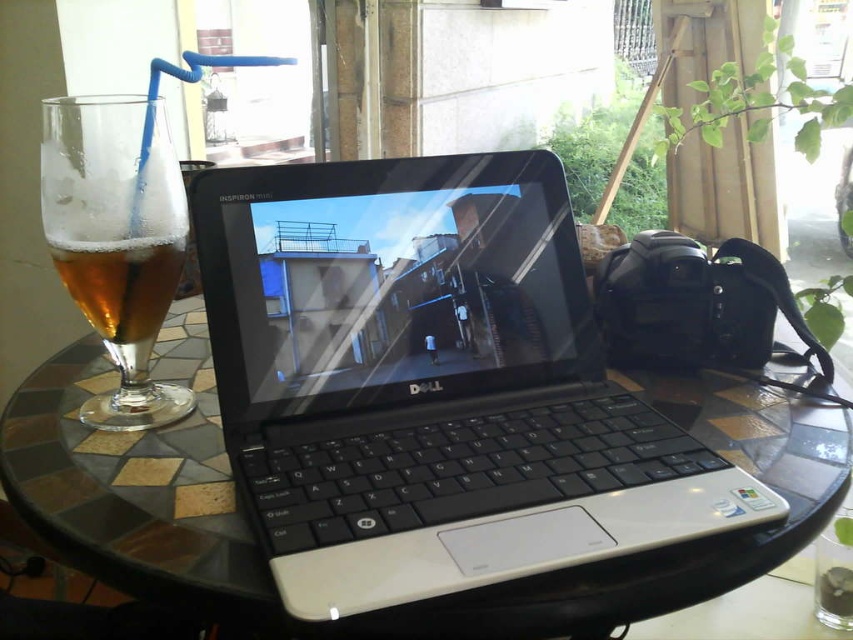
How much distance is there between black plastic laptop at center and amber glass at left?

13.35 centimeters

Is point (349, 212) positioned before point (140, 230)?

No, it is not.

What do you see at coordinates (431, 385) in the screenshot? I see `black plastic laptop at center` at bounding box center [431, 385].

I want to click on black plastic laptop at center, so click(x=431, y=385).